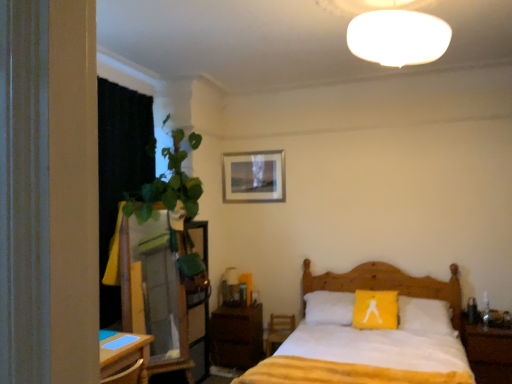
Where is `vacant space in front of matte glass table lamp at center`? vacant space in front of matte glass table lamp at center is located at coordinates (233, 307).